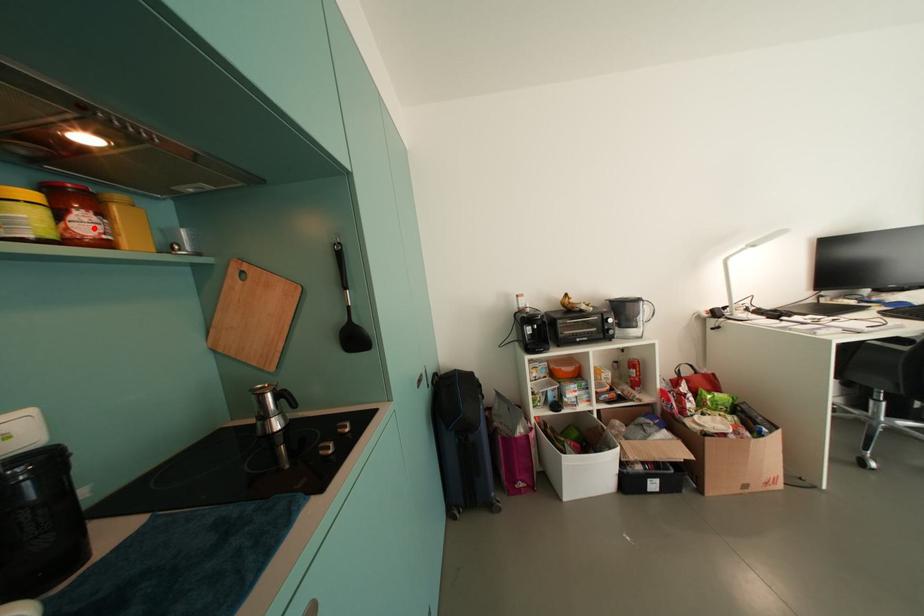
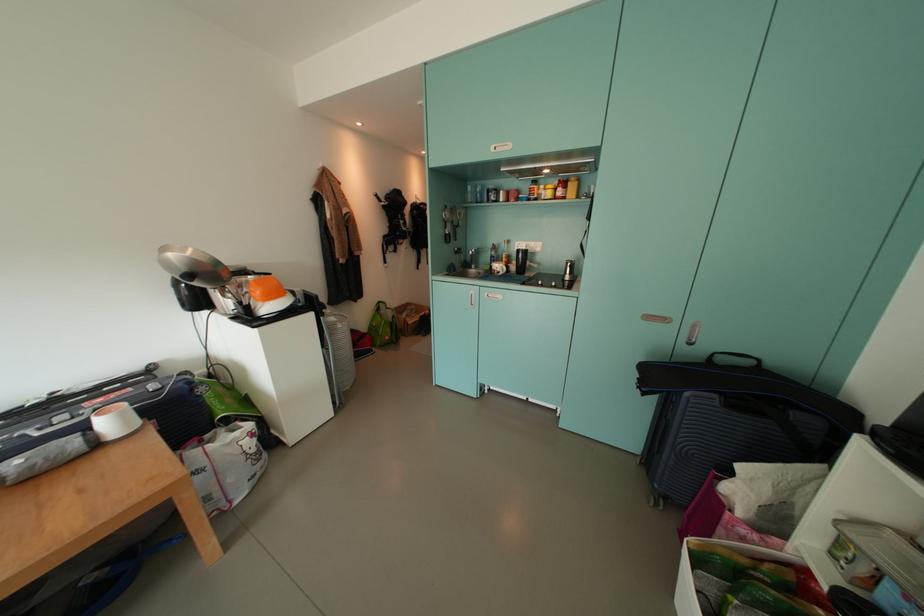
Question: I am providing you with two images of the same scene from different viewpoints. A red point is shown in image1. For the corresponding object point in image2, is it positioned nearer or farther from the camera?

Choices:
 (A) Nearer
 (B) Farther

Answer: (A)